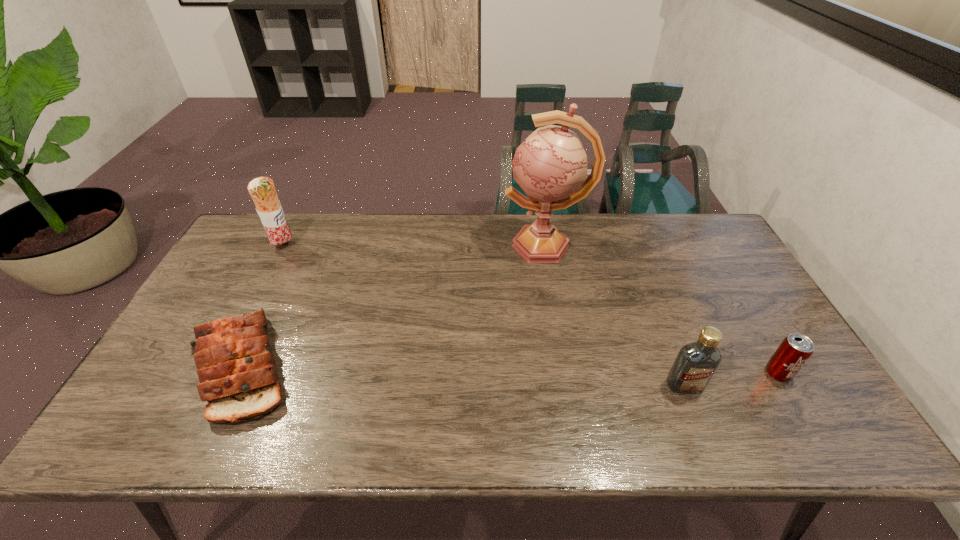
I want to click on free space located 0.340m on the right of the second tallest object, so click(397, 246).

At what (x,y) coordinates should I click in order to perform the action: click on free space located 0.090m on the front-facing side of the second object from right to left. Please return your answer as a coordinate pair (x, y). The height and width of the screenshot is (540, 960). Looking at the image, I should click on (703, 430).

This screenshot has width=960, height=540. What are the coordinates of `free space located 0.340m on the back of the rightmost object` in the screenshot? It's located at (719, 273).

Identify the location of free space located on the back of the bread. (284, 280).

You are a GUI agent. You are given a task and a screenshot of the screen. Output one action in this format:
    pyautogui.click(x=<x>, y=<y>)
    Task: Click on the globe present at the far edge
    
    Given the screenshot: What is the action you would take?
    pyautogui.click(x=550, y=166)

Locate an element on the screen. The height and width of the screenshot is (540, 960). burrito that is at the far edge is located at coordinates (262, 190).

What are the coordinates of `object that is at the near edge` in the screenshot? It's located at (236, 367).

You are a GUI agent. You are given a task and a screenshot of the screen. Output one action in this format:
    pyautogui.click(x=<x>, y=<y>)
    Task: Click on the burrito that is at the left edge
    This screenshot has height=540, width=960.
    Given the screenshot: What is the action you would take?
    pyautogui.click(x=262, y=190)

The image size is (960, 540). In order to click on bread positioned at the left edge in this screenshot , I will do `click(236, 367)`.

This screenshot has height=540, width=960. Find the location of `object at the right edge`. object at the right edge is located at coordinates [794, 351].